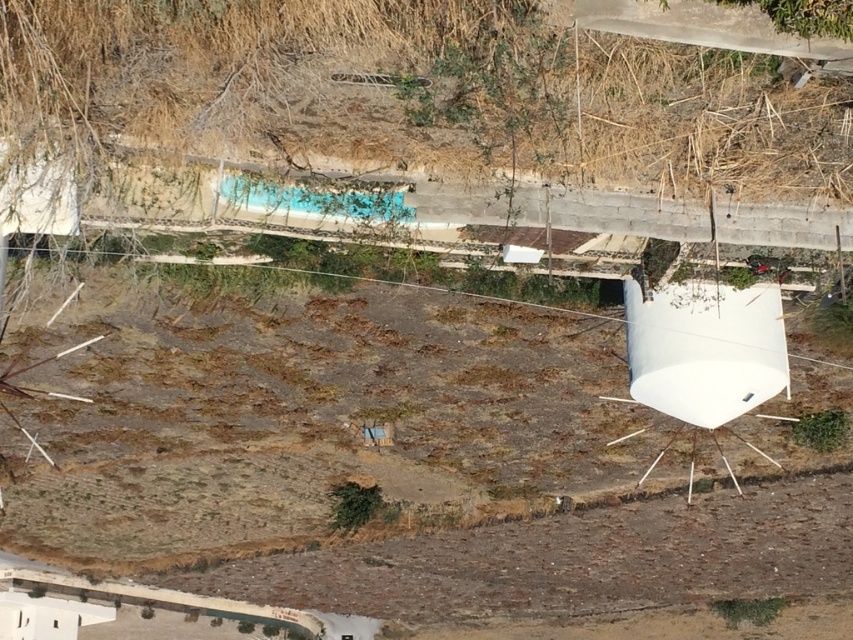
Question: Is brown soil at center bigger than dry grass at upper center?

Choices:
 (A) no
 (B) yes

Answer: (B)

Question: Which of the following is the farthest from the observer?

Choices:
 (A) brown soil at center
 (B) dry grass at upper center

Answer: (A)

Question: Which object is farther from the camera taking this photo?

Choices:
 (A) dry grass at upper center
 (B) brown soil at center

Answer: (B)

Question: Is brown soil at center smaller than dry grass at upper center?

Choices:
 (A) no
 (B) yes

Answer: (A)

Question: Is brown soil at center to the right of dry grass at upper center from the viewer's perspective?

Choices:
 (A) no
 (B) yes

Answer: (A)